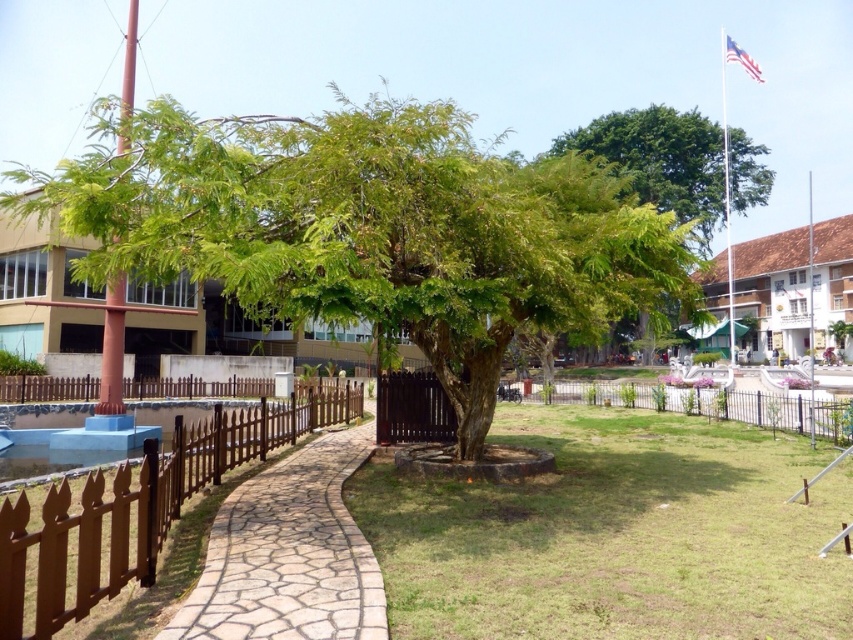
You are standing at the point with coordinates point (343, 152) and want to walk towards the point with coordinates point (734, 44). Given that both points are part of the curved stone pathway leading to the tree, which direction should you move relative to your current position?

Since point (343, 152) is closer to the camera than point (734, 44), you should move forward along the curved stone pathway to reach the point (734, 44).

You are standing at the entrance of the park and see the black wrought iron fence at lower right and the american flag at upper right. Which object is closer to you?

The black wrought iron fence at lower right is closer to you because it is in front of the american flag at upper right.